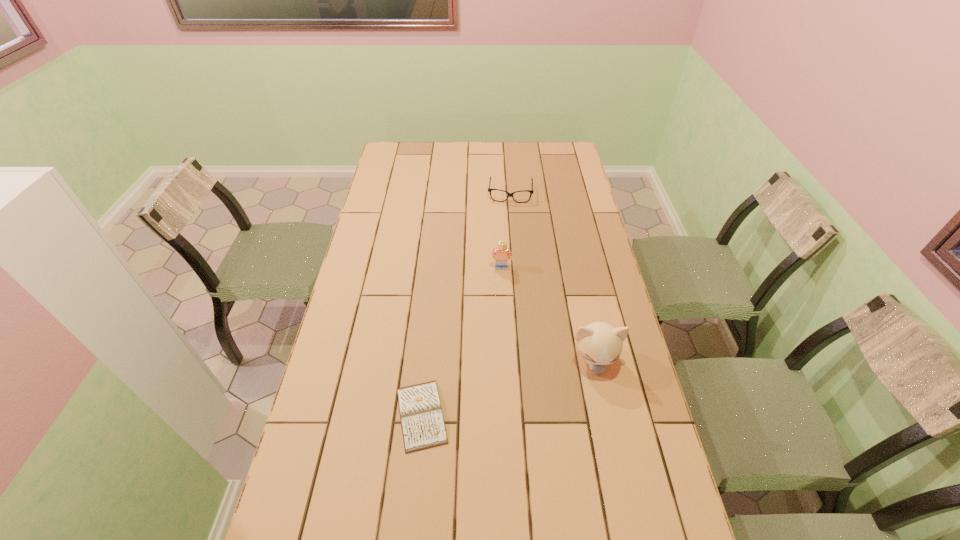
Where is `the leftmost object`? the leftmost object is located at coordinates (422, 421).

At what (x,y) coordinates should I click in order to perform the action: click on the shortest object. Please return your answer as a coordinate pair (x, y). Image resolution: width=960 pixels, height=540 pixels. Looking at the image, I should click on [422, 421].

I want to click on kitten, so click(x=599, y=343).

Find the location of a particular element. The height and width of the screenshot is (540, 960). the tallest object is located at coordinates (599, 343).

Locate an element on the screen. The height and width of the screenshot is (540, 960). the third nearest object is located at coordinates (500, 254).

Find the location of a particular element. This screenshot has height=540, width=960. the second tallest object is located at coordinates [500, 254].

At what (x,y) coordinates should I click in order to perform the action: click on the farthest object. Please return your answer as a coordinate pair (x, y). Looking at the image, I should click on (489, 189).

In order to click on the second shortest object in this screenshot , I will do `click(489, 189)`.

What are the coordinates of `vacant space situated on the right of the leftmost object` in the screenshot? It's located at (597, 415).

Locate an element on the screen. free point located 0.400m on the face of the tallest object is located at coordinates (631, 534).